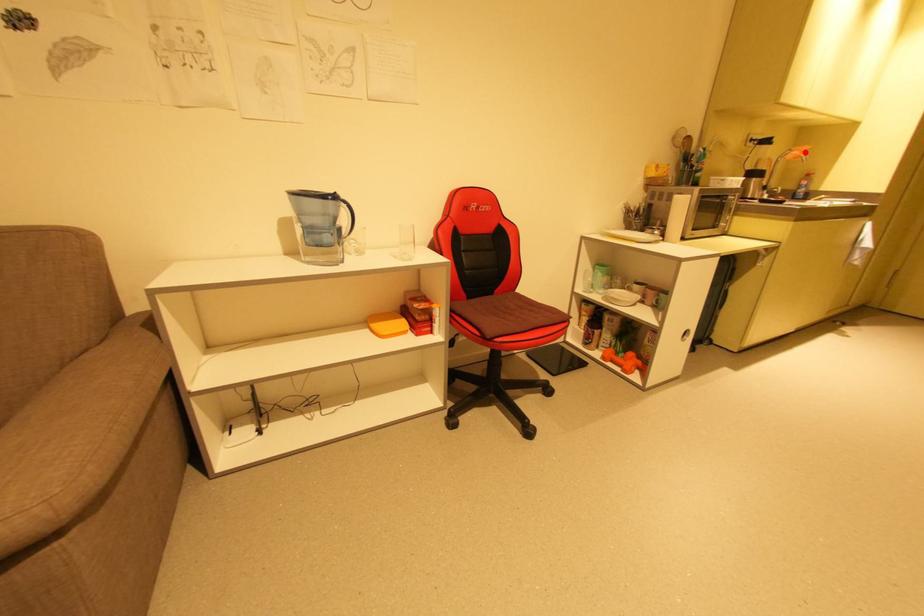
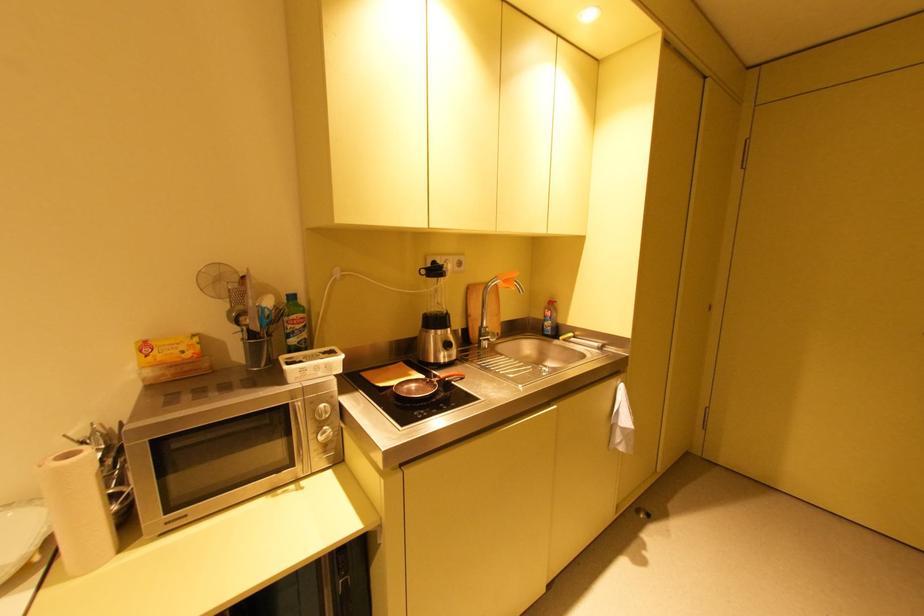
The point at the highlighted location is marked in the first image. Where is the corresponding point in the second image?

(508, 282)